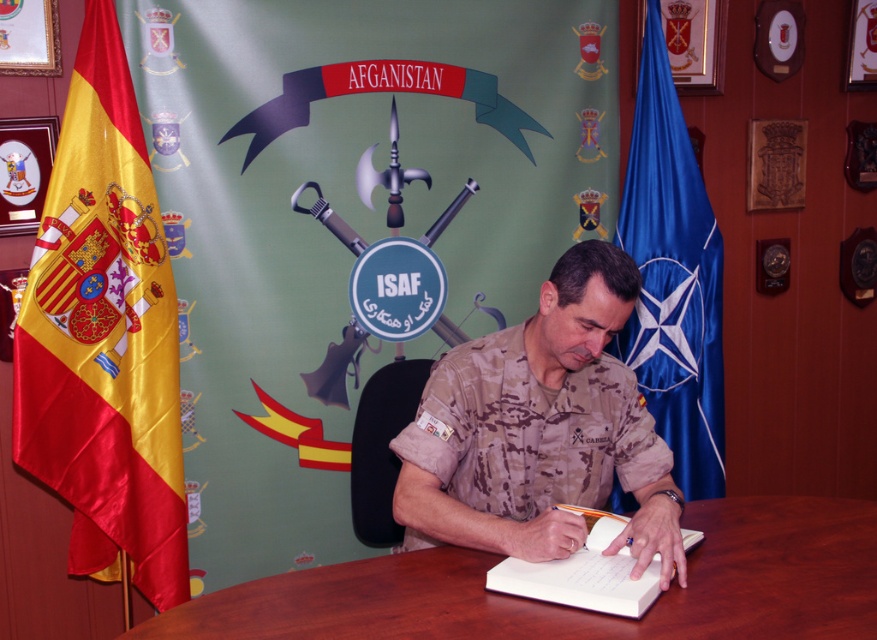
Can you confirm if yellow satin flag at left is positioned to the left of blue satin flag at right?

Yes, yellow satin flag at left is to the left of blue satin flag at right.

Is yellow satin flag at left closer to camera compared to blue satin flag at right?

Yes, it is.

Where is `yellow satin flag at left`? The height and width of the screenshot is (640, 877). yellow satin flag at left is located at coordinates pyautogui.click(x=104, y=336).

Which is below, blue satin flag at right or white paper notebook at center?

white paper notebook at center is below.

Which is behind, point (700, 397) or point (586, 541)?

The point (700, 397) is behind.

Where is `blue satin flag at right`? The width and height of the screenshot is (877, 640). blue satin flag at right is located at coordinates (672, 278).

Who is lower down, brown wooden table at center or white paper notebook at center?

brown wooden table at center is lower down.

The width and height of the screenshot is (877, 640). Describe the element at coordinates (576, 609) in the screenshot. I see `brown wooden table at center` at that location.

In order to click on brown wooden table at center in this screenshot , I will do `click(576, 609)`.